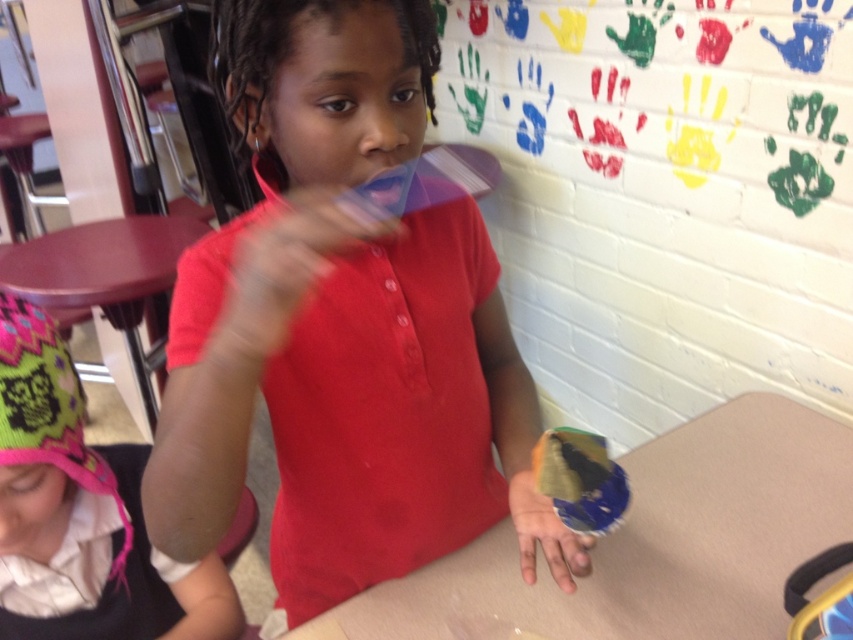
You are a photographer trying to capture a closeup of the pink knitted hat at lower left while also including the smooth brown table at lower left in the frame. Based on their positions, which object should you move closer to the camera to ensure both are visible without cropping?

The pink knitted hat at lower left is positioned on the right side of smooth brown table at lower left. To include both in the frame without cropping, you should move the pink knitted hat at lower left closer to the camera since it is already on the right side of the table and might be further away if the table is at the edge.

You are organizing a classroom cleanup and need to place the pink knitted hat at lower left and the smooth brown table at lower left into storage. Which object should you store first if you want to maximize space efficiency?

The pink knitted hat at lower left has a smaller size compared to the smooth brown table at lower left. Therefore, you should store the smooth brown table at lower left first to utilize larger spaces first for efficiency.

You are a teacher organizing an art class. You have two tables in the room, the smooth beige table at center and the smooth brown table at lower left. You need to place a 4 feet long art supply cart between them. Will the space between the two tables be sufficient to accommodate the cart?

The smooth beige table at center is 3.60 feet from the smooth brown table at lower left. Since the cart is 4 feet long, the distance between the tables is insufficient to fit the cart.